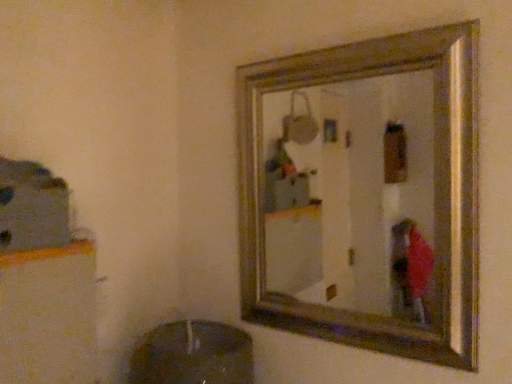
Where is `shiny metallic sink at lower left`? shiny metallic sink at lower left is located at coordinates (193, 354).

This screenshot has width=512, height=384. What do you see at coordinates (193, 354) in the screenshot?
I see `shiny metallic sink at lower left` at bounding box center [193, 354].

Measure the distance between shiny metallic sink at lower left and camera.

shiny metallic sink at lower left is 33.64 inches from camera.

Find the location of a particular element. This screenshot has height=384, width=512. shiny metallic sink at lower left is located at coordinates (193, 354).